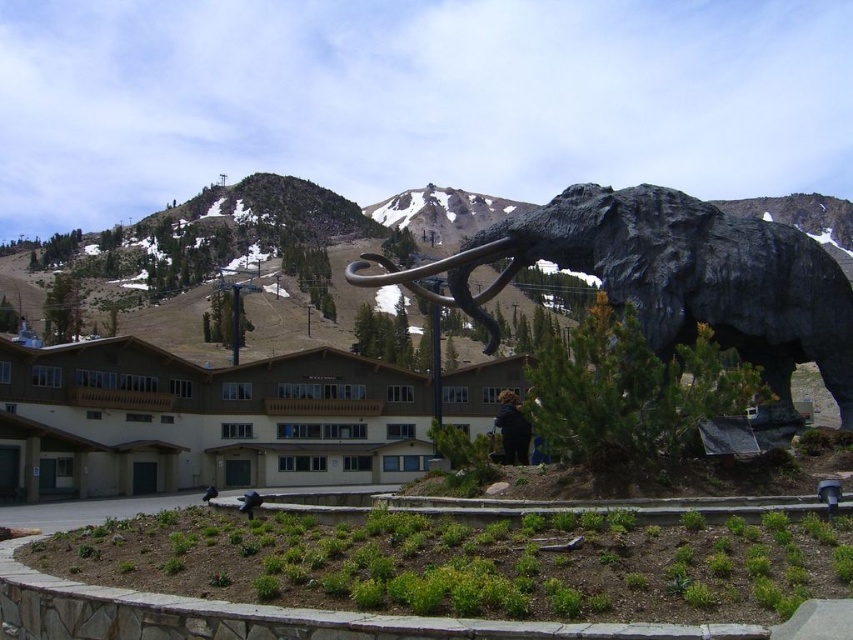
You are standing in front of the large dark sculpture of a woolly mammoth. You notice two points marked on the ground at coordinates point [318,348] and point [335,212]. Which point is closer to you?

Point [318,348] is closer to the viewer than point [335,212].

You are a hiker standing at the base of the rugged stone mountain at center and want to reach the black polished stone elephant at center. Which direction should you move relative to the mountain?

The black polished stone elephant at center is located below the rugged stone mountain at center, so you should move downward towards the base of the mountain to reach it.